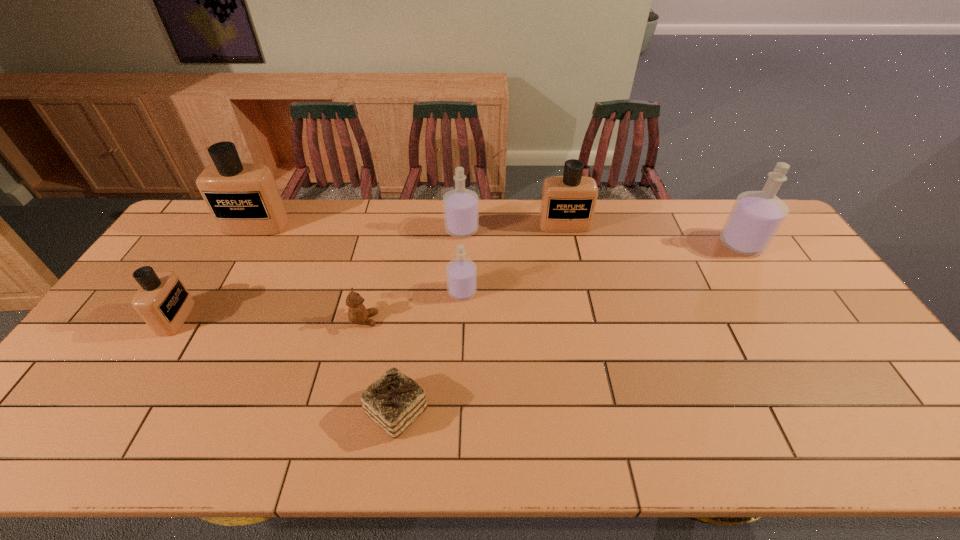
Locate an element on the screen. The image size is (960, 540). the second closest purple perfume to the second biggest purple perfume is located at coordinates (756, 216).

Choose which beige perfume is the third nearest neighbor to the nearest purple perfume. Please provide its 2D coordinates. Your answer should be formatted as a tuple, i.e. [(x, y)], where the tuple contains the x and y coordinates of a point satisfying the conditions above.

[(162, 301)]

This screenshot has height=540, width=960. In order to click on beige perfume object that ranks as the second closest to the fifth object from right to left in this screenshot , I will do `click(568, 202)`.

The image size is (960, 540). I want to click on vacant area in the image that satisfies the following two spatial constraints: 1. on the front side of the smallest purple perfume; 2. on the right side of the second biggest purple perfume, so click(459, 292).

Where is `free location that satisfies the following two spatial constraints: 1. on the front label of the biggest beige perfume; 2. on the right side of the rightmost purple perfume`? Image resolution: width=960 pixels, height=540 pixels. free location that satisfies the following two spatial constraints: 1. on the front label of the biggest beige perfume; 2. on the right side of the rightmost purple perfume is located at coordinates (246, 244).

At what (x,y) coordinates should I click in order to perform the action: click on free space that satisfies the following two spatial constraints: 1. on the front label of the biggest beige perfume; 2. on the front label of the smallest beige perfume. Please return your answer as a coordinate pair (x, y). Looking at the image, I should click on (203, 318).

Identify the location of vacant region that satisfies the following two spatial constraints: 1. on the front label of the second smallest purple perfume; 2. on the left side of the biggest beige perfume. The height and width of the screenshot is (540, 960). (253, 229).

I want to click on vacant space that satisfies the following two spatial constraints: 1. on the front side of the rightmost object; 2. on the front label of the nearest beige perfume, so click(x=789, y=318).

You are a GUI agent. You are given a task and a screenshot of the screen. Output one action in this format:
    pyautogui.click(x=<x>, y=<y>)
    Task: Click on the free spot that satisfies the following two spatial constraints: 1. on the front side of the nearest purple perfume; 2. on the front label of the nearest beige perfume
    
    Given the screenshot: What is the action you would take?
    pyautogui.click(x=461, y=318)